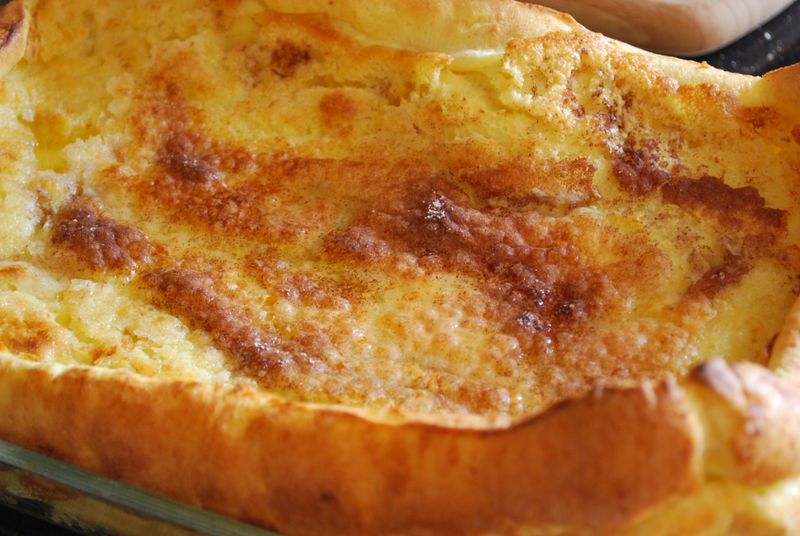
The height and width of the screenshot is (536, 800). In order to click on plate in this screenshot , I will do `click(770, 36)`.